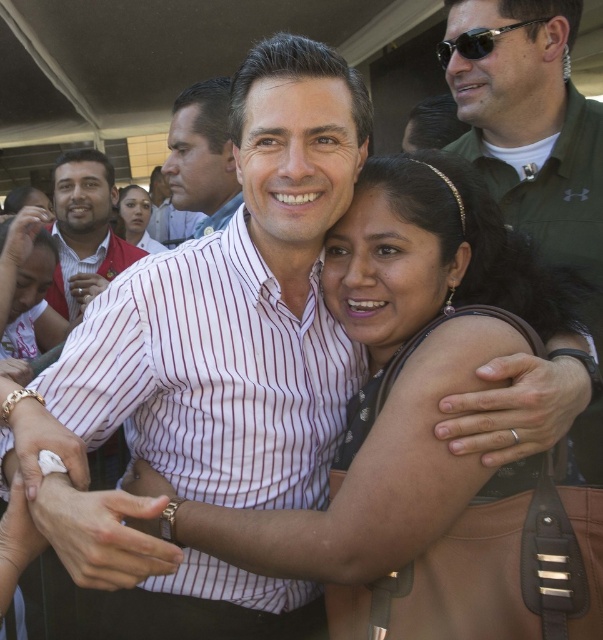
You are standing in the crowd at this event and want to take a photo of the man in the white shirt with red vertical stripes and the woman he is embracing. If you position yourself at point [209,108], will you be close enough to capture both of them clearly in your photo?

The point [209,108] is 2.19 meters away from the viewer. Since this distance is relatively close, you should be able to capture both the man in the white shirt with red vertical stripes and the woman he is embracing clearly in your photo.

You are a photographer trying to capture a photo of the political event. You need to ensure that both the green fabric shirt at upper right and the matte red shirt at left are visible in the frame. Given their sizes, which one might you need to adjust your camera angle to include?

The green fabric shirt at upper right is much taller than the matte red shirt at left, so you might need to adjust the camera angle to account for its greater height to ensure both are fully visible in the frame.